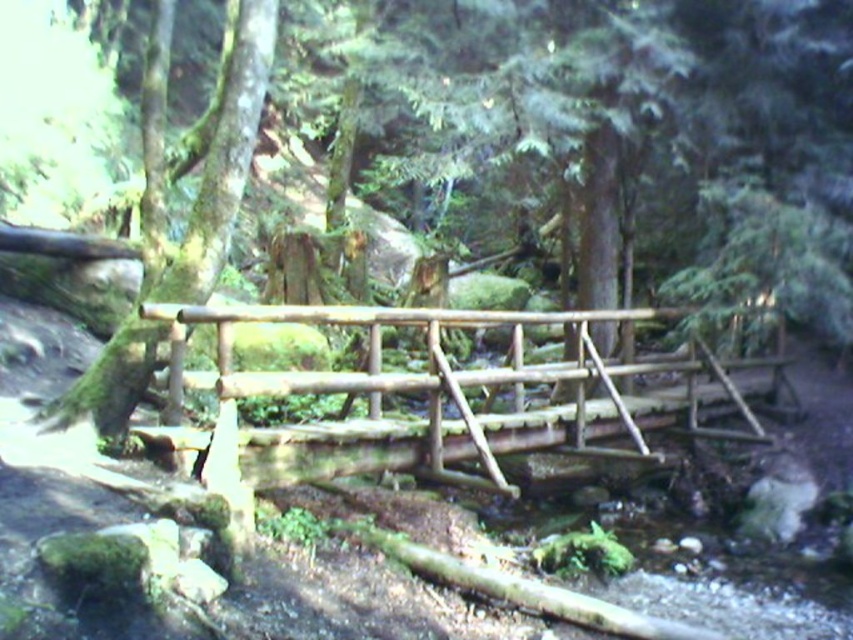
Question: Which point is farther from the camera taking this photo?

Choices:
 (A) (132, 321)
 (B) (287, 371)

Answer: (B)

Question: Can you confirm if natural wood bridge at center is positioned above green mossy tree at left?

Choices:
 (A) yes
 (B) no

Answer: (B)

Question: Can you confirm if natural wood bridge at center is positioned above green mossy tree at left?

Choices:
 (A) yes
 (B) no

Answer: (B)

Question: Is natural wood bridge at center smaller than green mossy tree at left?

Choices:
 (A) no
 (B) yes

Answer: (A)